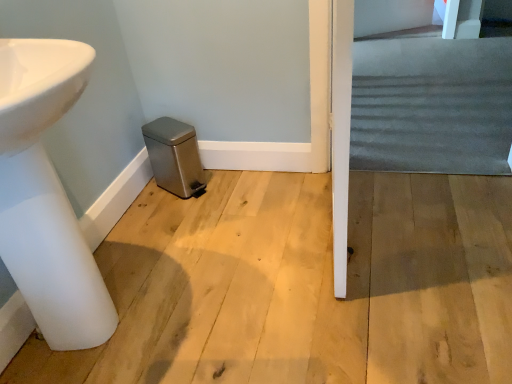
Question: Is white glossy sink at lower left thinner than dark gray carpet at right?

Choices:
 (A) yes
 (B) no

Answer: (A)

Question: From a real-world perspective, is white glossy sink at lower left on top of dark gray carpet at right?

Choices:
 (A) no
 (B) yes

Answer: (B)

Question: Does white glossy sink at lower left touch dark gray carpet at right?

Choices:
 (A) no
 (B) yes

Answer: (A)

Question: Does white glossy sink at lower left have a larger size compared to dark gray carpet at right?

Choices:
 (A) no
 (B) yes

Answer: (A)

Question: Would you consider white glossy sink at lower left to be distant from dark gray carpet at right?

Choices:
 (A) yes
 (B) no

Answer: (A)

Question: Can we say white glossy sink at lower left lies outside dark gray carpet at right?

Choices:
 (A) yes
 (B) no

Answer: (A)

Question: Is dark gray carpet at right oriented towards white glossy sink at lower left?

Choices:
 (A) no
 (B) yes

Answer: (A)

Question: Can you confirm if dark gray carpet at right is bigger than white glossy sink at lower left?

Choices:
 (A) yes
 (B) no

Answer: (A)

Question: Is dark gray carpet at right to the right of white glossy sink at lower left from the viewer's perspective?

Choices:
 (A) no
 (B) yes

Answer: (B)

Question: Can we say dark gray carpet at right lies outside white glossy sink at lower left?

Choices:
 (A) no
 (B) yes

Answer: (B)

Question: Is dark gray carpet at right oriented away from white glossy sink at lower left?

Choices:
 (A) yes
 (B) no

Answer: (B)

Question: From a real-world perspective, is dark gray carpet at right below white glossy sink at lower left?

Choices:
 (A) yes
 (B) no

Answer: (A)

Question: Choose the correct answer: Is dark gray carpet at right inside white glossy sink at lower left or outside it?

Choices:
 (A) outside
 (B) inside

Answer: (A)